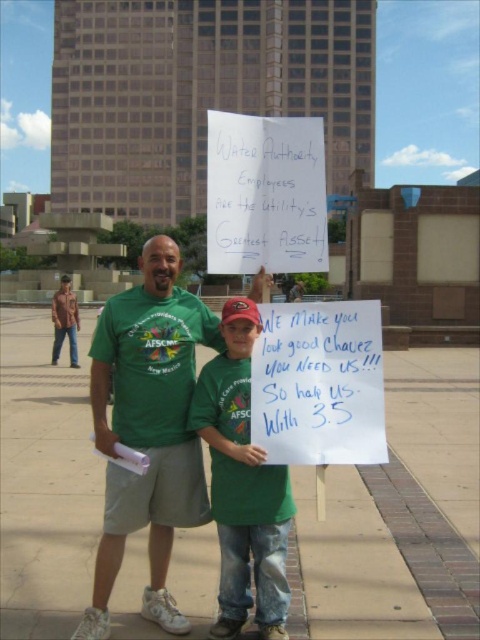
Question: Which object is farther from the camera taking this photo?

Choices:
 (A) green fabric shirt at center
 (B) jeans at left

Answer: (B)

Question: Considering the relative positions of green fabric shirt at center and jeans at left in the image provided, where is green fabric shirt at center located with respect to jeans at left?

Choices:
 (A) above
 (B) below

Answer: (B)

Question: Which of the following is the farthest from the observer?

Choices:
 (A) (69, 326)
 (B) (222, 358)

Answer: (A)

Question: Is green matte shirt at center smaller than jeans at left?

Choices:
 (A) no
 (B) yes

Answer: (B)

Question: Which object is positioned closest to the green matte shirt at center?

Choices:
 (A) green fabric shirt at center
 (B) jeans at left

Answer: (A)

Question: Is green fabric shirt at center below jeans at left?

Choices:
 (A) yes
 (B) no

Answer: (A)